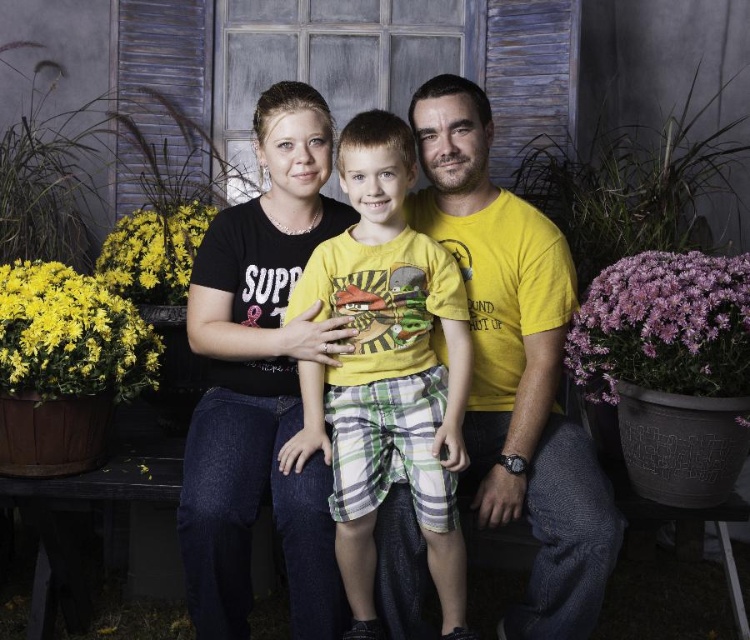
Question: Which of the following is the farthest from the observer?

Choices:
 (A) yellow cotton shirt at center
 (B) black corduroy shirt at center
 (C) yellow matte shirt at center

Answer: (A)

Question: Is yellow matte shirt at center further to camera compared to yellow cotton shirt at center?

Choices:
 (A) yes
 (B) no

Answer: (B)

Question: From the image, what is the correct spatial relationship of black corduroy shirt at center in relation to yellow cotton shirt at center?

Choices:
 (A) right
 (B) left

Answer: (B)

Question: Which point is farther from the camera taking this photo?

Choices:
 (A) (462, 568)
 (B) (531, 241)

Answer: (B)

Question: Does yellow matte shirt at center have a lesser width compared to black corduroy shirt at center?

Choices:
 (A) yes
 (B) no

Answer: (B)

Question: Which object is the farthest from the yellow matte shirt at center?

Choices:
 (A) yellow cotton shirt at center
 (B) black corduroy shirt at center

Answer: (B)